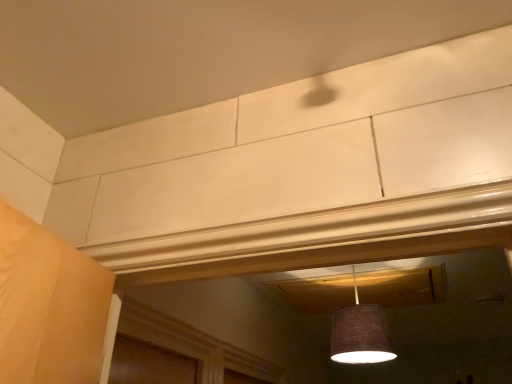
Question: Should I look upward or downward to see brown fabric lampshade at center?

Choices:
 (A) up
 (B) down

Answer: (B)